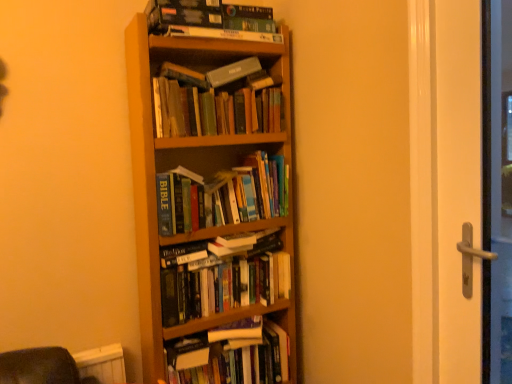
Question: Is wooden bookcase at center to the left of hardcover book at center, arranged as the sixth book when viewed from the top, from the viewer's perspective?

Choices:
 (A) yes
 (B) no

Answer: (A)

Question: Is wooden bookcase at center positioned before hardcover book at center, which appears as the first book when ordered from the bottom?

Choices:
 (A) yes
 (B) no

Answer: (A)

Question: Does wooden bookcase at center have a larger size compared to hardcover book at center, which appears as the first book when ordered from the bottom?

Choices:
 (A) no
 (B) yes

Answer: (B)

Question: Is wooden bookcase at center oriented away from hardcover book at center, which appears as the first book when ordered from the bottom?

Choices:
 (A) yes
 (B) no

Answer: (A)

Question: Is wooden bookcase at center aimed at hardcover book at center, which appears as the first book when ordered from the bottom?

Choices:
 (A) no
 (B) yes

Answer: (B)

Question: From a real-world perspective, is wooden bookcase at center positioned under hardcover book at center, arranged as the sixth book when viewed from the top, based on gravity?

Choices:
 (A) no
 (B) yes

Answer: (A)

Question: Is hardcover gray book at upper center to the right of wooden bookcase at center from the viewer's perspective?

Choices:
 (A) yes
 (B) no

Answer: (A)

Question: Is hardcover gray book at upper center positioned beyond the bounds of wooden bookcase at center?

Choices:
 (A) no
 (B) yes

Answer: (A)

Question: Does hardcover gray book at upper center come behind wooden bookcase at center?

Choices:
 (A) no
 (B) yes

Answer: (B)

Question: Is hardcover gray book at upper center positioned in front of wooden bookcase at center?

Choices:
 (A) yes
 (B) no

Answer: (B)

Question: Does hardcover gray book at upper center have a greater height compared to wooden bookcase at center?

Choices:
 (A) no
 (B) yes

Answer: (A)

Question: From a real-world perspective, is hardcover gray book at upper center physically below wooden bookcase at center?

Choices:
 (A) no
 (B) yes

Answer: (A)

Question: From the image's perspective, is hardcover books at center, the 5th book in the top-to-bottom sequence, on top of hardcover gray book at upper center?

Choices:
 (A) yes
 (B) no

Answer: (B)